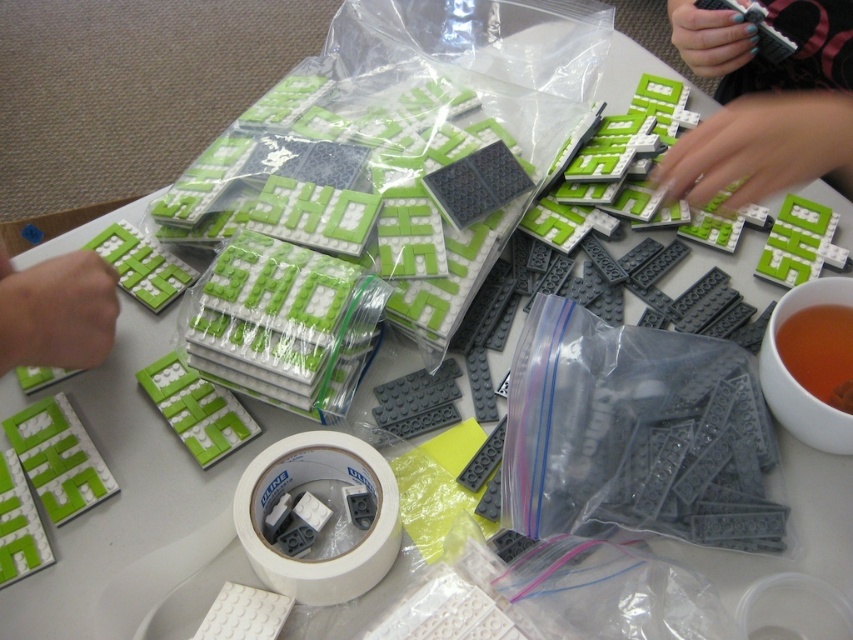
Who is more forward, (828, 140) or (849, 392)?

Point (828, 140) is more forward.

Does green matte lego brick at upper right appear on the left side of brown liquid at lower right?

No, green matte lego brick at upper right is not to the left of brown liquid at lower right.

The width and height of the screenshot is (853, 640). I want to click on green matte lego brick at upper right, so click(763, 102).

Image resolution: width=853 pixels, height=640 pixels. In order to click on green matte lego brick at upper right in this screenshot , I will do `click(763, 102)`.

Does matte green plastic lego at lower left have a lesser width compared to brown liquid at lower right?

No.

Between point (54, 320) and point (781, 346), which one is positioned behind?

Positioned behind is point (781, 346).

At what (x,y) coordinates should I click in order to perform the action: click on matte green plastic lego at lower left. Please return your answer as a coordinate pair (x, y). This screenshot has width=853, height=640. Looking at the image, I should click on (56, 310).

Does green matte lego brick at upper right have a larger size compared to matte green plastic lego at lower left?

Indeed, green matte lego brick at upper right has a larger size compared to matte green plastic lego at lower left.

Which of these two, green matte lego brick at upper right or matte green plastic lego at lower left, stands shorter?

With less height is matte green plastic lego at lower left.

Between point (746, 141) and point (33, 275), which one is positioned in front?

Point (33, 275) is in front.

You are a GUI agent. You are given a task and a screenshot of the screen. Output one action in this format:
    pyautogui.click(x=<x>, y=<y>)
    Task: Click on the green matte lego brick at upper right
    The image size is (853, 640).
    Given the screenshot: What is the action you would take?
    pyautogui.click(x=763, y=102)